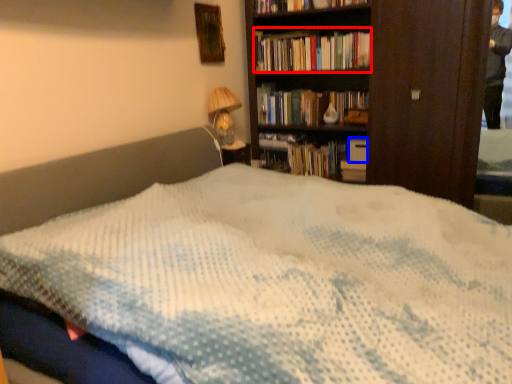
Question: Which of the following is the closest to the observer, book (highlighted by a red box) or paperback book (highlighted by a blue box)?

Choices:
 (A) book
 (B) paperback book

Answer: (A)